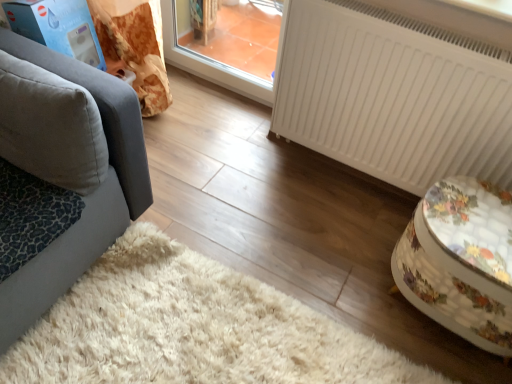
Question: Is leopard print fabric cat bed at lower left at the left side of gray fabric pillow at left?

Choices:
 (A) yes
 (B) no

Answer: (A)

Question: Is leopard print fabric cat bed at lower left surrounding gray fabric pillow at left?

Choices:
 (A) yes
 (B) no

Answer: (B)

Question: Considering the relative sizes of leopard print fabric cat bed at lower left and gray fabric pillow at left in the image provided, is leopard print fabric cat bed at lower left bigger than gray fabric pillow at left?

Choices:
 (A) yes
 (B) no

Answer: (B)

Question: Is leopard print fabric cat bed at lower left closer to the viewer compared to gray fabric pillow at left?

Choices:
 (A) no
 (B) yes

Answer: (A)

Question: Considering the relative sizes of leopard print fabric cat bed at lower left and gray fabric pillow at left in the image provided, is leopard print fabric cat bed at lower left wider than gray fabric pillow at left?

Choices:
 (A) yes
 (B) no

Answer: (A)

Question: Which is correct: leopard print fabric cat bed at lower left is inside floral fabric ottoman at right, or outside of it?

Choices:
 (A) inside
 (B) outside

Answer: (B)

Question: Considering the relative positions of leopard print fabric cat bed at lower left and floral fabric ottoman at right in the image provided, is leopard print fabric cat bed at lower left to the left or to the right of floral fabric ottoman at right?

Choices:
 (A) left
 (B) right

Answer: (A)

Question: Is leopard print fabric cat bed at lower left in front of or behind floral fabric ottoman at right in the image?

Choices:
 (A) behind
 (B) front

Answer: (B)

Question: From their relative heights in the image, would you say leopard print fabric cat bed at lower left is taller or shorter than floral fabric ottoman at right?

Choices:
 (A) tall
 (B) short

Answer: (B)

Question: Considering the positions of floral fabric ottoman at right and gray fabric pillow at left in the image, is floral fabric ottoman at right wider or thinner than gray fabric pillow at left?

Choices:
 (A) wide
 (B) thin

Answer: (A)

Question: Is floral fabric ottoman at right in front of or behind gray fabric pillow at left in the image?

Choices:
 (A) front
 (B) behind

Answer: (B)

Question: Is floral fabric ottoman at right inside or outside of gray fabric pillow at left?

Choices:
 (A) inside
 (B) outside

Answer: (B)

Question: In the image, is floral fabric ottoman at right on the left side or the right side of gray fabric pillow at left?

Choices:
 (A) left
 (B) right

Answer: (B)

Question: From a real-world perspective, is floral fabric ottoman at right positioned above or below white matte radiator at right?

Choices:
 (A) below
 (B) above

Answer: (A)

Question: Is floral fabric ottoman at right bigger or smaller than white matte radiator at right?

Choices:
 (A) small
 (B) big

Answer: (A)